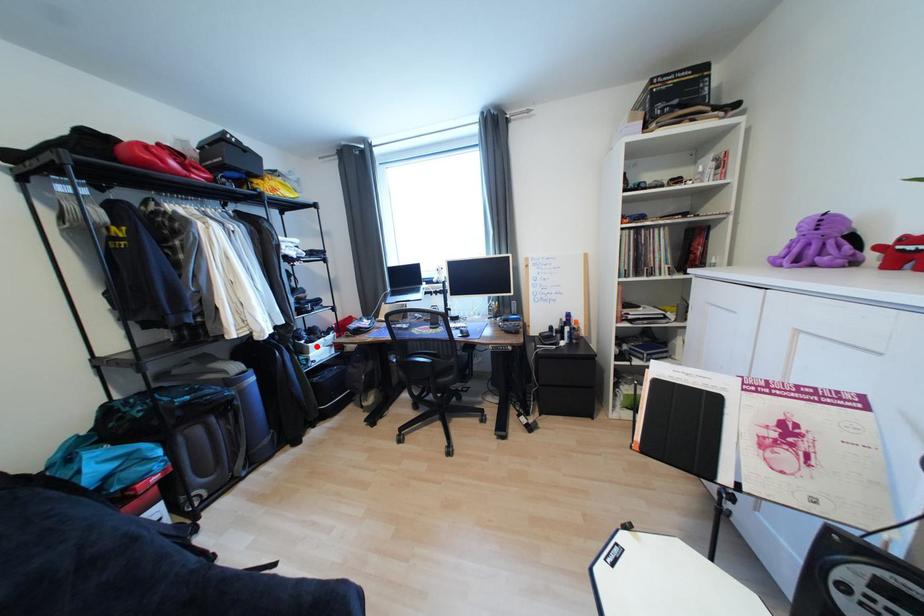
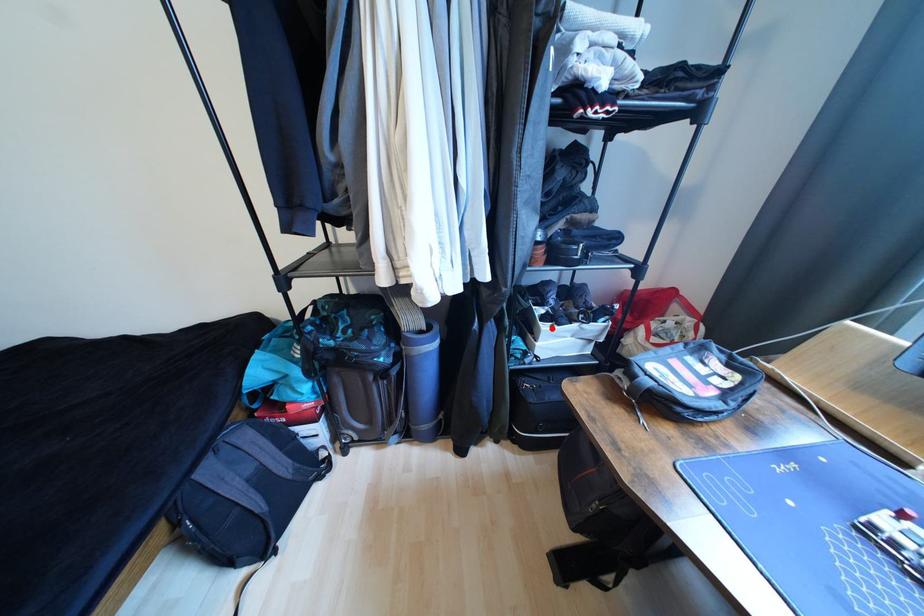
I am providing you with two images of the same scene from different viewpoints. A red point is marked on the first image and another point is marked on the second image. Is the marked point in image1 the same physical position as the marked point in image2?

Yes